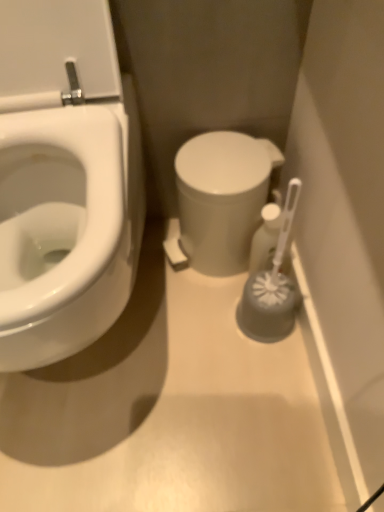
Question: Considering the positions of gray rubber brush at right and white glossy toilet at center in the image, is gray rubber brush at right taller or shorter than white glossy toilet at center?

Choices:
 (A) short
 (B) tall

Answer: (B)

Question: Considering their positions, is gray rubber brush at right located in front of or behind white glossy toilet at center?

Choices:
 (A) behind
 (B) front

Answer: (B)

Question: Which is nearer to the gray rubber brush at right?

Choices:
 (A) white glossy toilet at center
 (B) white plastic toilet brush at right
 (C) white glossy bidet at left

Answer: (B)

Question: Considering the real-world distances, which object is closest to the white plastic toilet brush at right?

Choices:
 (A) gray rubber brush at right
 (B) white glossy toilet at center
 (C) white glossy bidet at left

Answer: (A)